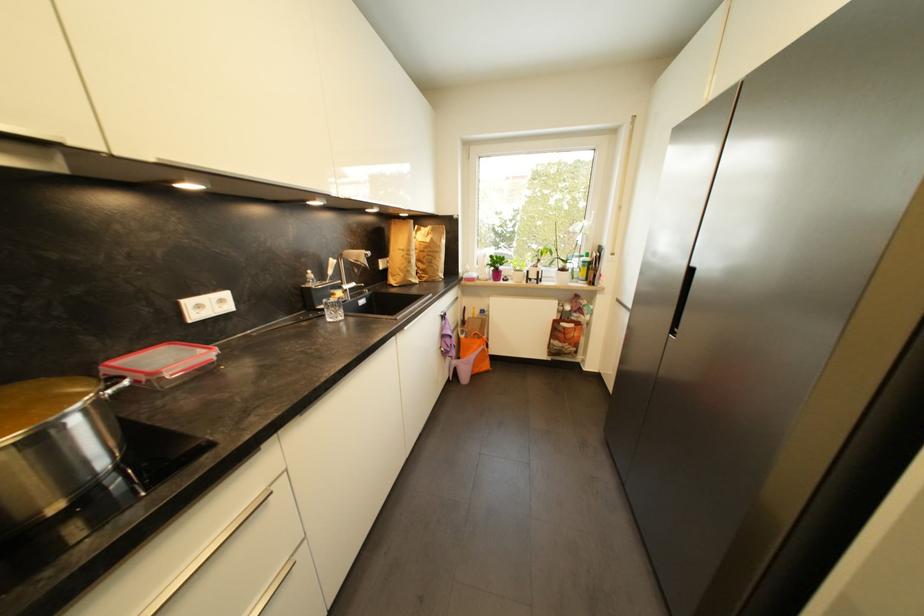
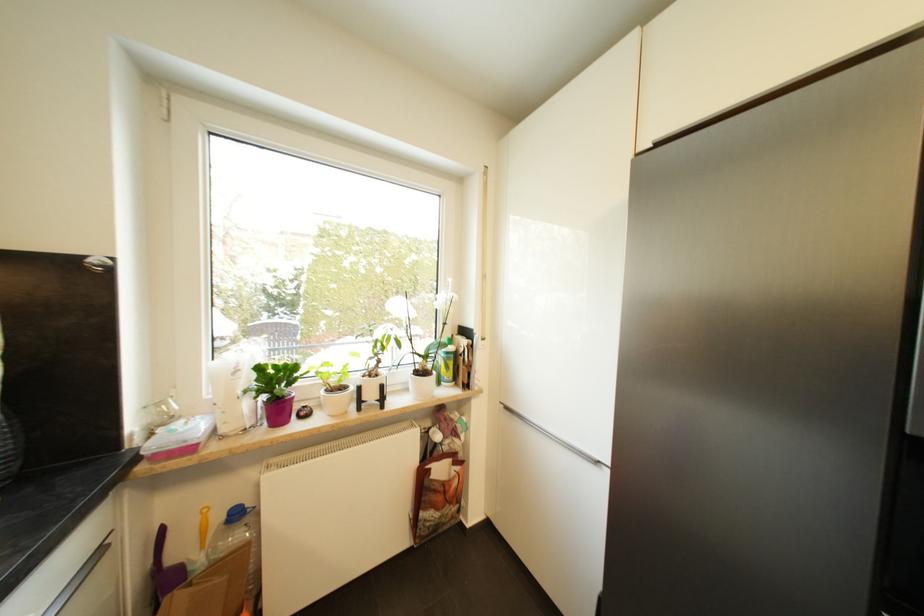
In the second image, find the point that corresponds to pixel 463 300 in the first image.

(105, 553)